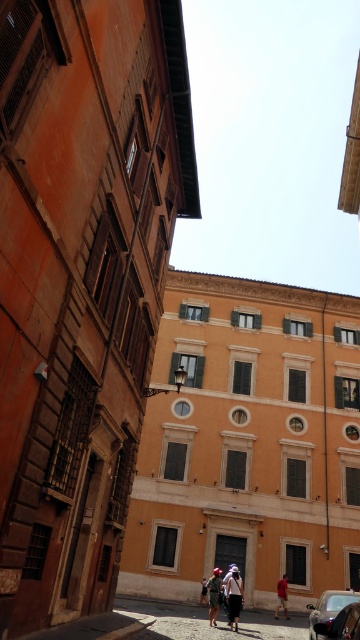
Question: Which object appears farthest from the camera in this image?

Choices:
 (A) denim shorts at center
 (B) shiny black car at center

Answer: (A)

Question: Does shiny black car at center come behind denim jacket at center?

Choices:
 (A) yes
 (B) no

Answer: (B)

Question: Can you confirm if shiny black car at center is smaller than brown leather jacket at center?

Choices:
 (A) no
 (B) yes

Answer: (A)

Question: Is shiny black car at center positioned before brown leather jacket at center?

Choices:
 (A) yes
 (B) no

Answer: (A)

Question: Which object is the farthest from the denim shorts at center?

Choices:
 (A) shiny black car at center
 (B) brown leather jacket at center

Answer: (B)

Question: Based on their relative distances, which object is farther from the brown leather jacket at center?

Choices:
 (A) shiny black car at center
 (B) denim shorts at center
 (C) denim jacket at center

Answer: (C)